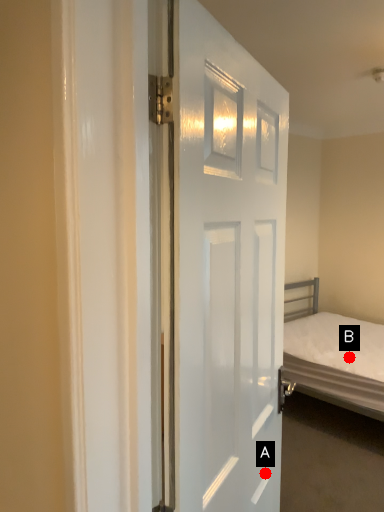
Question: Two points are circled on the image, labeled by A and B beside each circle. Which point appears closest to the camera in this image?

Choices:
 (A) A is closer
 (B) B is closer

Answer: (A)